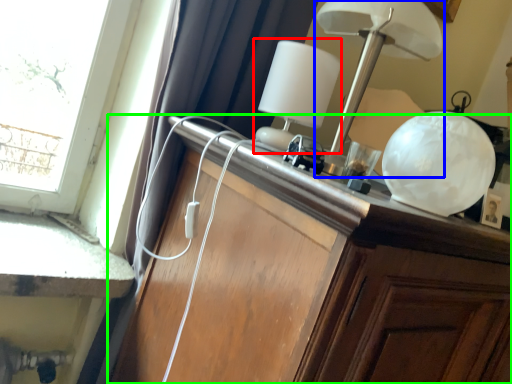
Question: Which object is positioned closest to table lamp (highlighted by a red box)? Select from lamp (highlighted by a blue box) and cabinetry (highlighted by a green box).

Choices:
 (A) lamp
 (B) cabinetry

Answer: (A)